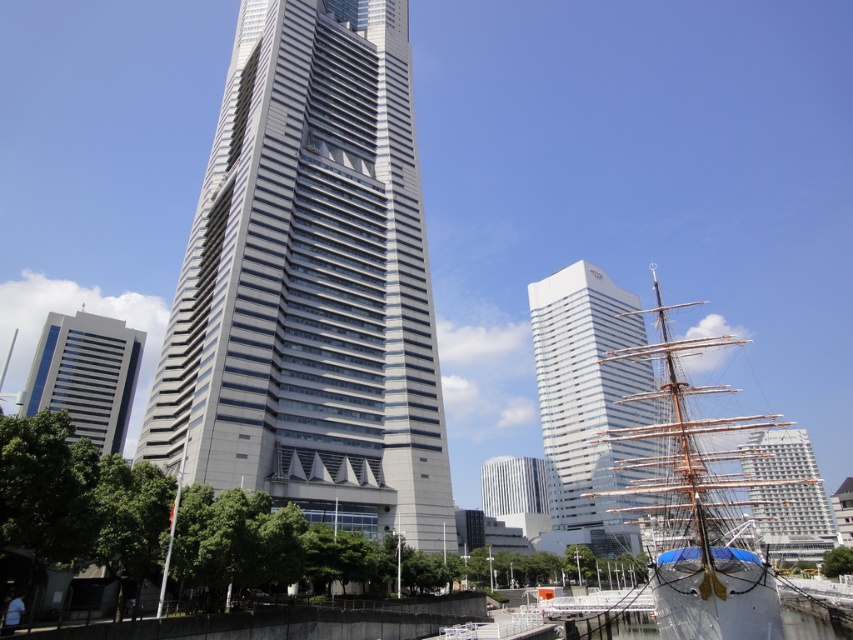
Between white glass tower at center and white glossy building at center, which one is positioned lower?

Positioned lower is white glossy building at center.

Between point (619, 292) and point (540, 490), which one is positioned behind?

Positioned behind is point (540, 490).

Which is in front, point (582, 476) or point (546, 513)?

Positioned in front is point (582, 476).

Locate an element on the screen. Image resolution: width=853 pixels, height=640 pixels. white glass tower at center is located at coordinates (587, 403).

Does blue glass skyscraper at left have a larger size compared to white textured building at right?

No.

Who is more forward, (80, 333) or (750, 444)?

Positioned in front is point (80, 333).

In order to click on blue glass skyscraper at left in this screenshot , I will do `click(86, 374)`.

Is wooden ship at center to the right of white textured building at right from the viewer's perspective?

In fact, wooden ship at center is to the left of white textured building at right.

Can you confirm if wooden ship at center is wider than white textured building at right?

Yes.

Who is more distant from viewer, (668,620) or (827,525)?

Positioned behind is point (827,525).

Locate an element on the screen. The width and height of the screenshot is (853, 640). wooden ship at center is located at coordinates (695, 506).